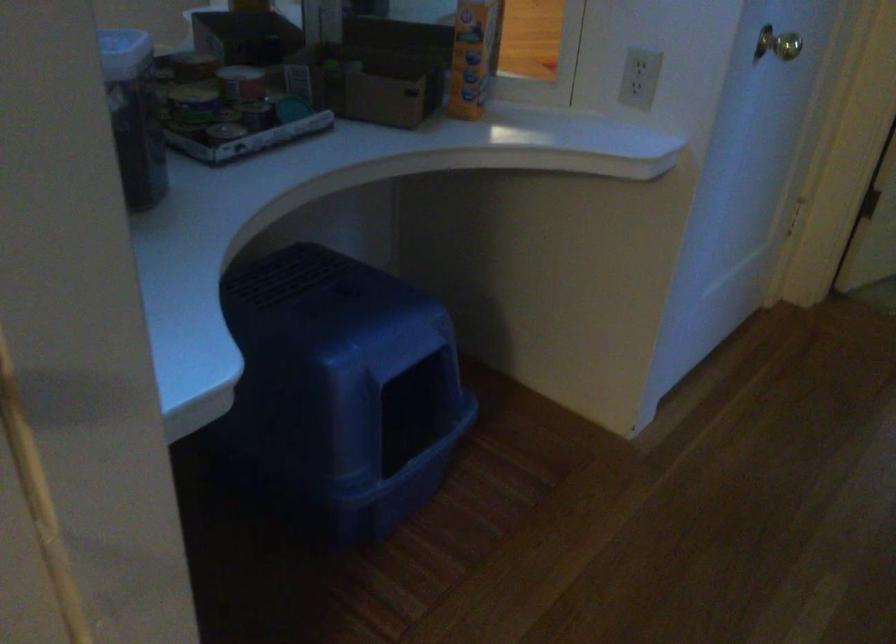
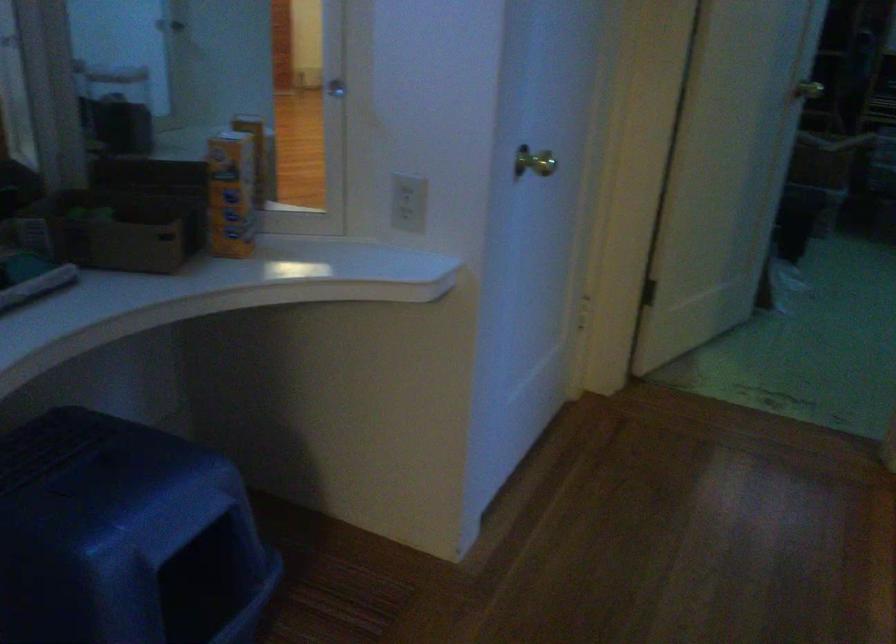
Locate, in the second image, the point that corresponds to pixel 351 351 in the first image.

(124, 536)